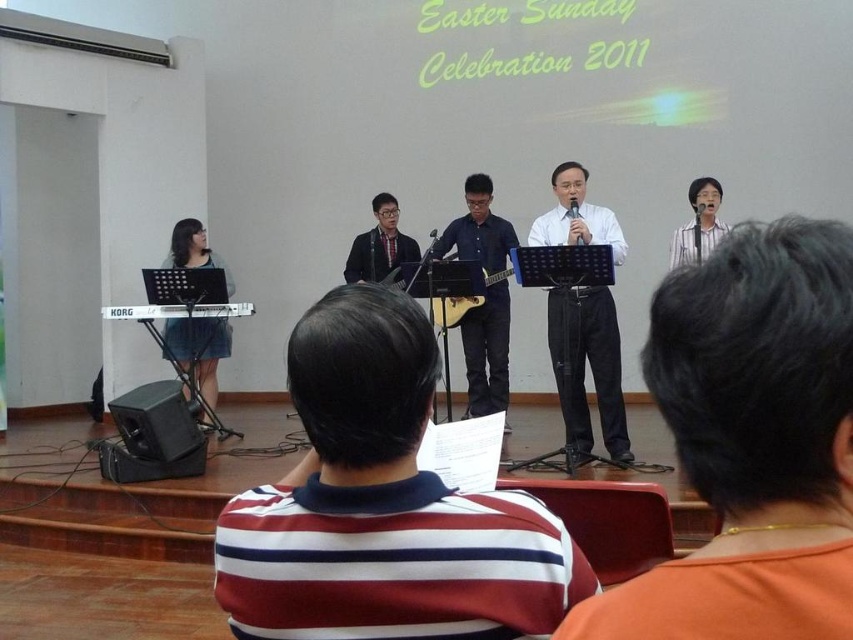
Between orange fabric at upper right and blue matte guitar at center, which one appears on the left side from the viewer's perspective?

orange fabric at upper right is more to the left.

Where is `orange fabric at upper right`? This screenshot has height=640, width=853. orange fabric at upper right is located at coordinates (751, 442).

Consider the image. Can you confirm if white smooth shirt at center is thinner than blue matte guitar at center?

Correct, white smooth shirt at center's width is less than blue matte guitar at center's.

Does white smooth shirt at center appear over blue matte guitar at center?

Incorrect, white smooth shirt at center is not positioned above blue matte guitar at center.

You are a GUI agent. You are given a task and a screenshot of the screen. Output one action in this format:
    pyautogui.click(x=<x>, y=<y>)
    Task: Click on the white smooth shirt at center
    Image resolution: width=853 pixels, height=640 pixels.
    Given the screenshot: What is the action you would take?
    pyautogui.click(x=589, y=365)

In order to click on white smooth shirt at center in this screenshot , I will do `click(589, 365)`.

Is orange fabric at upper right behind white smooth shirt at center?

That is False.

Is orange fabric at upper right below white smooth shirt at center?

Correct, orange fabric at upper right is located below white smooth shirt at center.

Identify the location of orange fabric at upper right. The image size is (853, 640). (751, 442).